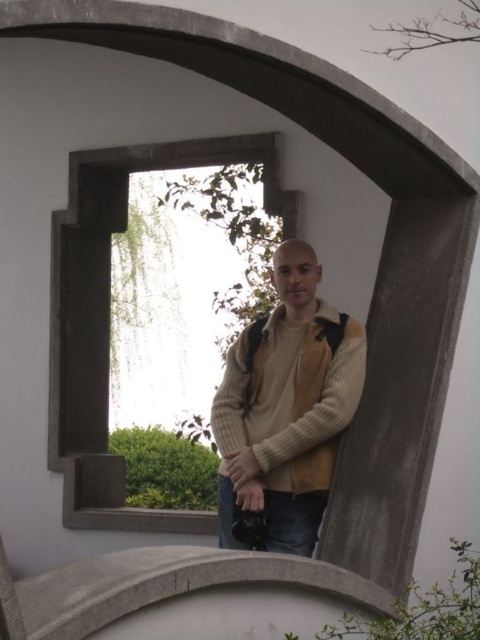
Question: Can you confirm if stone window frame at center is positioned to the right of knit sweater at center?

Choices:
 (A) no
 (B) yes

Answer: (A)

Question: Which point is closer to the camera taking this photo?

Choices:
 (A) (72, 442)
 (B) (220, 435)

Answer: (B)

Question: Which point is closer to the camera taking this photo?

Choices:
 (A) tap(283, 448)
 (B) tap(64, 476)

Answer: (A)

Question: Which point is farther to the camera?

Choices:
 (A) stone window frame at center
 (B) knit sweater at center

Answer: (A)

Question: Can you confirm if stone window frame at center is wider than knit sweater at center?

Choices:
 (A) yes
 (B) no

Answer: (A)

Question: Does stone window frame at center lie in front of knit sweater at center?

Choices:
 (A) yes
 (B) no

Answer: (B)